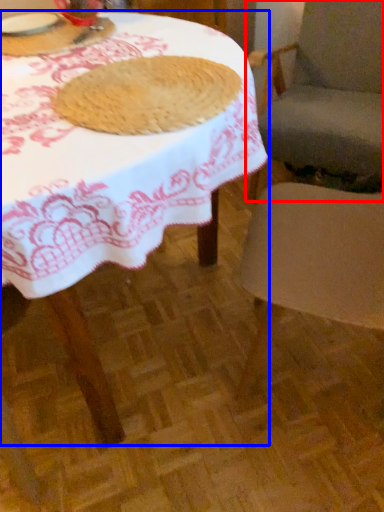
Question: Which of the following is the farthest to the observer, chair (highlighted by a red box) or table (highlighted by a blue box)?

Choices:
 (A) chair
 (B) table

Answer: (A)